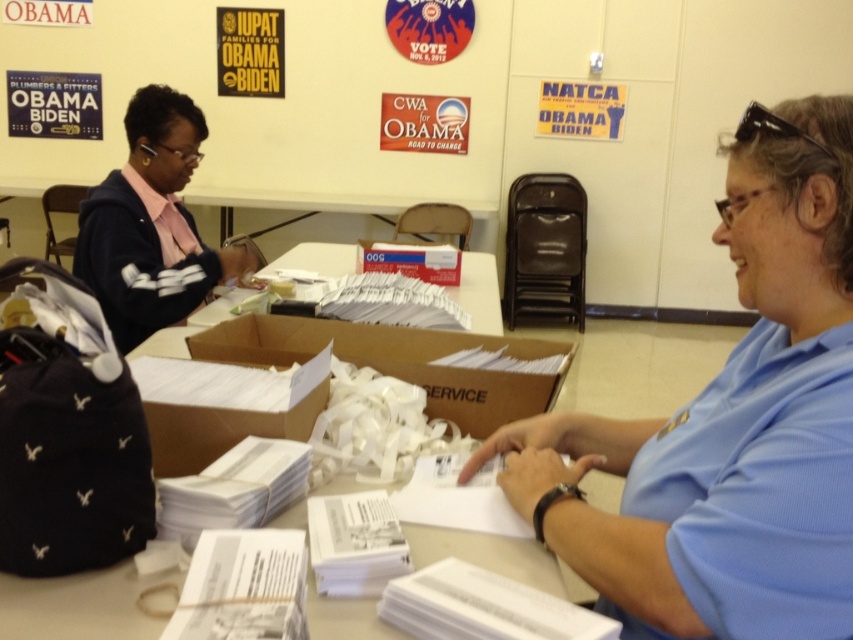
From the picture: Which of these two, blue shirt at center or cardboard box at center, stands taller?

With more height is blue shirt at center.

Is point (822, 184) positioned after point (265, 358)?

No, (822, 184) is in front of (265, 358).

You are a GUI agent. You are given a task and a screenshot of the screen. Output one action in this format:
    pyautogui.click(x=<x>, y=<y>)
    Task: Click on the blue shirt at center
    Image resolution: width=853 pixels, height=640 pixels.
    Given the screenshot: What is the action you would take?
    pyautogui.click(x=729, y=428)

Does dark blue sweater at left have a larger size compared to matte cardboard box at center?

Yes.

Measure the distance between point [155,291] and camera.

The distance of point [155,291] from camera is 6.99 feet.

Does point (119, 250) come in front of point (457, 269)?

Yes, point (119, 250) is in front of point (457, 269).

Where is `dark blue sweater at left`? This screenshot has height=640, width=853. dark blue sweater at left is located at coordinates (149, 225).

Is point (136, 44) behind point (143, 106)?

Yes.

Is matte black poster at upper left above dark blue sweater at left?

Yes, matte black poster at upper left is above dark blue sweater at left.

Is point (161, 28) positioned before point (184, 269)?

No, (161, 28) is further to viewer.

The height and width of the screenshot is (640, 853). In order to click on matte black poster at upper left in this screenshot , I will do `click(271, 104)`.